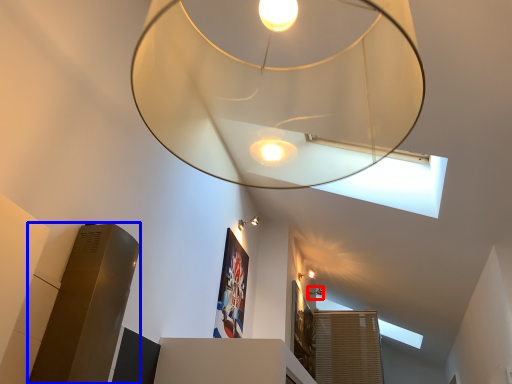
Question: Which of the following is the farthest to the observer, lamp (highlighted by a red box) or lift (highlighted by a blue box)?

Choices:
 (A) lamp
 (B) lift

Answer: (A)